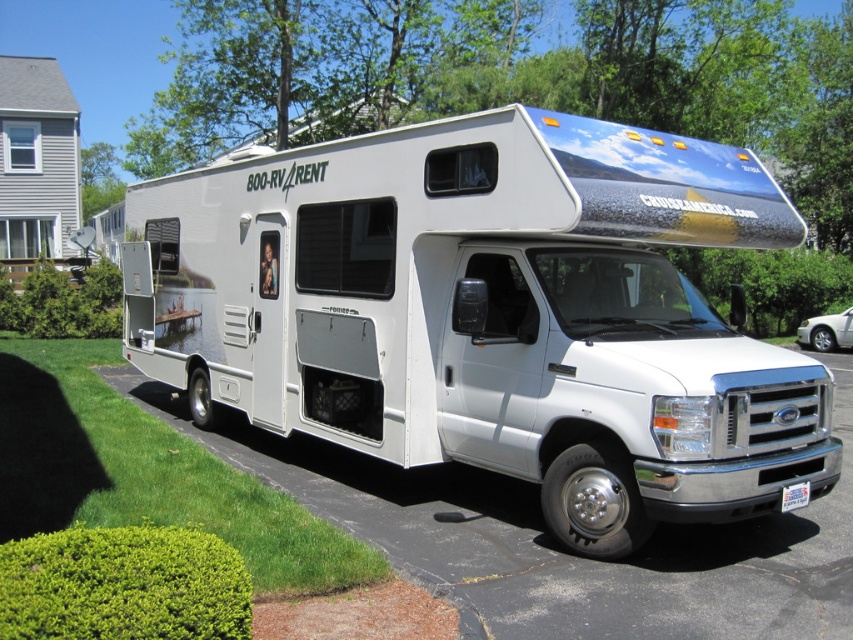
Can you confirm if white glossy recreational vehicle at center is taller than white asphalt driveway at lower center?

Yes, white glossy recreational vehicle at center is taller than white asphalt driveway at lower center.

Does white glossy recreational vehicle at center have a smaller size compared to white asphalt driveway at lower center?

No, white glossy recreational vehicle at center is not smaller than white asphalt driveway at lower center.

Does point (207, 384) come closer to viewer compared to point (242, 458)?

No.

Identify the location of white glossy recreational vehicle at center. The image size is (853, 640). (490, 314).